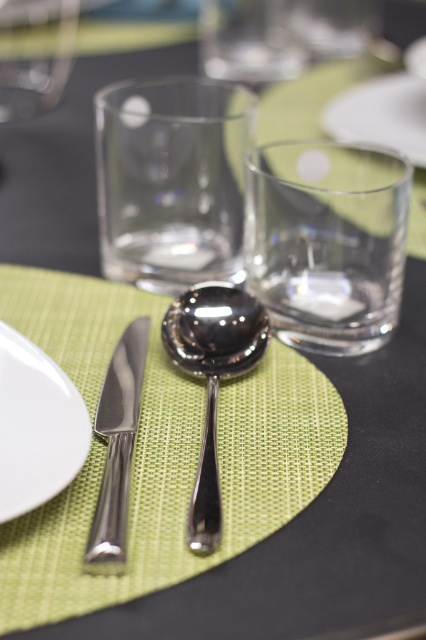
Is white glossy plate at lower left thinner than polished silver spoon at center?

Yes, white glossy plate at lower left is thinner than polished silver spoon at center.

Is white glossy plate at lower left to the right of polished silver spoon at center from the viewer's perspective?

No, white glossy plate at lower left is not to the right of polished silver spoon at center.

The height and width of the screenshot is (640, 426). In order to click on white glossy plate at lower left in this screenshot , I will do `click(37, 426)`.

Locate an element on the screen. The height and width of the screenshot is (640, 426). white glossy plate at lower left is located at coordinates (37, 426).

This screenshot has width=426, height=640. Describe the element at coordinates (37, 426) in the screenshot. I see `white glossy plate at lower left` at that location.

Who is lower down, white glossy plate at lower left or white matte plate at upper center?

Positioned lower is white glossy plate at lower left.

Between point (63, 374) and point (400, 148), which one is positioned in front?

Point (63, 374) is in front.

What are the coordinates of `white glossy plate at lower left` in the screenshot? It's located at (37, 426).

Does green woven placemat at center have a lesser height compared to polished silver spoon at center?

No.

What do you see at coordinates (158, 451) in the screenshot?
I see `green woven placemat at center` at bounding box center [158, 451].

Where is `green woven placemat at center`? green woven placemat at center is located at coordinates [x=158, y=451].